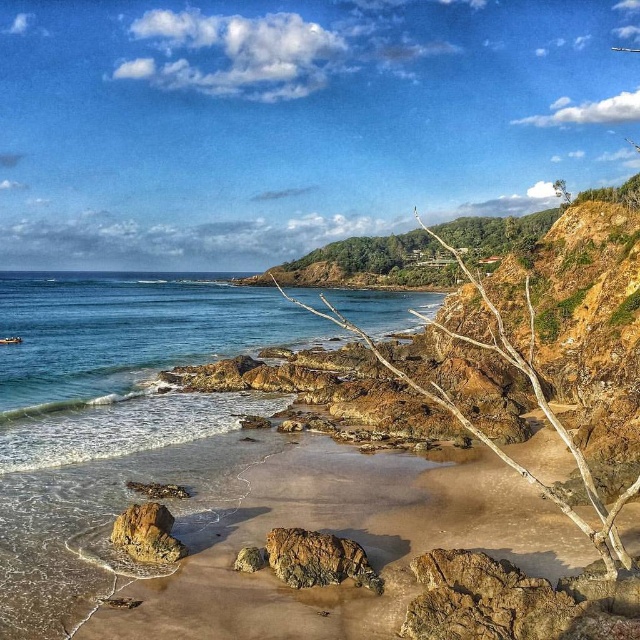
You are standing on the beach and see two rocks labeled as the rusty rock at center and the rusty metallic rock at center. Which one is located to the right when facing the ocean?

The rusty rock at center is positioned to the right of the rusty metallic rock at center, so when facing the ocean, the rusty rock at center is on the right side.

You are standing at the center of the beach and want to pick up the rusty rock at lower left. Which direction should you move to reach it?

The rusty rock at lower left is located at point 0.834 on the x and 0.230 on the y coordinate, so you should move to the lower left direction to reach it.